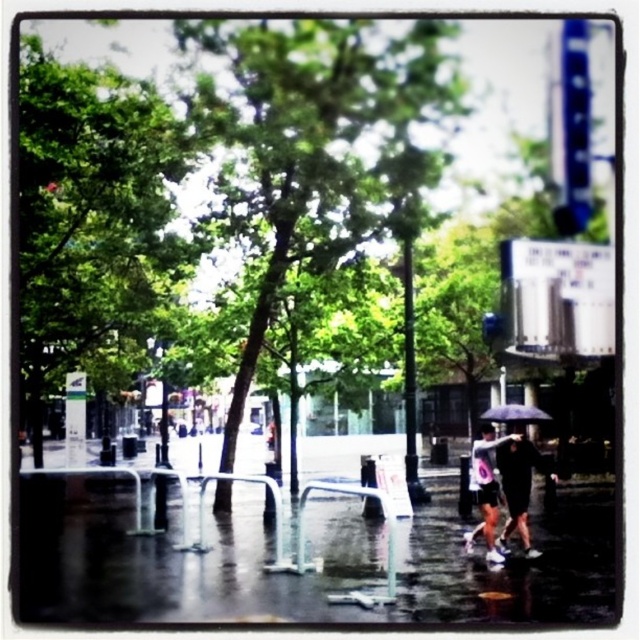
Question: Can you confirm if glossy concrete pavement at center is positioned to the left of white matte umbrella at lower right?

Choices:
 (A) yes
 (B) no

Answer: (A)

Question: Among these objects, which one is farthest from the camera?

Choices:
 (A) green leafy tree at upper left
 (B) black matte umbrella at lower right
 (C) glossy concrete pavement at center

Answer: (B)

Question: Among these points, which one is nearest to the camera?

Choices:
 (A) (364, 550)
 (B) (480, 472)
 (C) (488, 413)

Answer: (B)

Question: From the image, what is the correct spatial relationship of glossy concrete pavement at center in relation to green leafy tree at center?

Choices:
 (A) left
 (B) right

Answer: (A)

Question: Is green leafy tree at center bigger than black matte umbrella at lower right?

Choices:
 (A) yes
 (B) no

Answer: (B)

Question: Based on their relative distances, which object is farther from the black matte umbrella at lower right?

Choices:
 (A) dark gray fabric umbrella at lower right
 (B) green leafy tree at center
 (C) glossy concrete pavement at center
 (D) green leafy tree at upper left

Answer: (D)